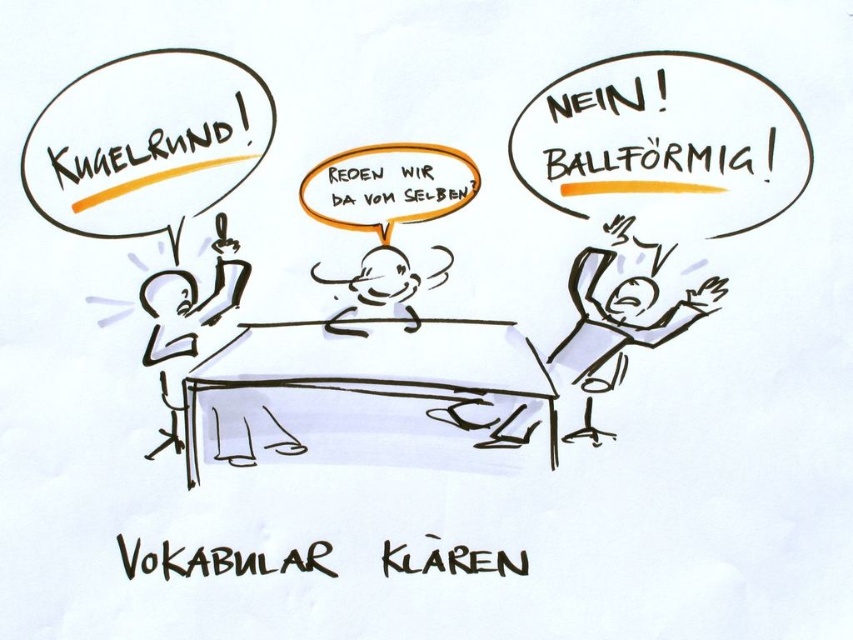
Question: Which is nearer to the smooth white head at center?

Choices:
 (A) gray paper at center
 (B) yellow marker text at upper left

Answer: (A)

Question: Which point is farther from the camera taking this photo?

Choices:
 (A) (68, 122)
 (B) (566, 333)

Answer: (B)

Question: Does yellow marker text at upper left come behind gray paper at center?

Choices:
 (A) yes
 (B) no

Answer: (B)

Question: Estimate the real-world distances between objects in this image. Which object is closer to the smooth white head at center?

Choices:
 (A) yellow marker text at upper left
 (B) gray paper at center

Answer: (B)

Question: Does gray paper at center appear on the right side of smooth white head at center?

Choices:
 (A) no
 (B) yes

Answer: (B)

Question: Is gray paper at center bigger than smooth white head at center?

Choices:
 (A) no
 (B) yes

Answer: (B)